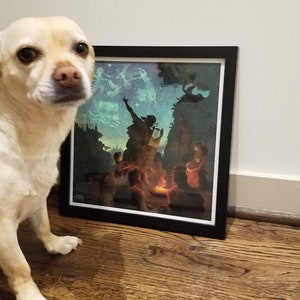
This screenshot has width=300, height=300. What are the coordinates of `picture frame` in the screenshot? It's located at (227, 103), (180, 52), (70, 158), (153, 223).